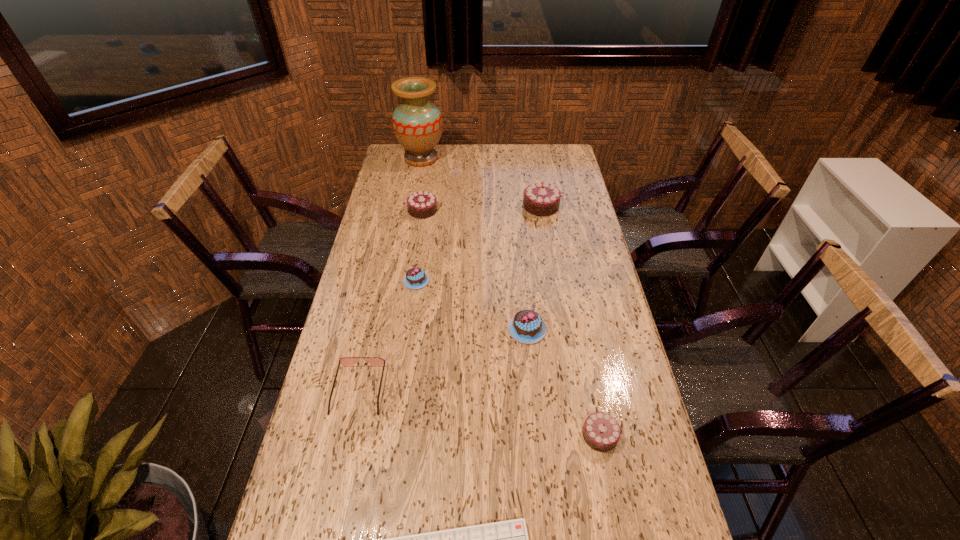
At what (x,y) coordinates should I click in order to perform the action: click on the tallest object. Please return your answer as a coordinate pair (x, y). The height and width of the screenshot is (540, 960). Looking at the image, I should click on (417, 123).

You are a GUI agent. You are given a task and a screenshot of the screen. Output one action in this format:
    pyautogui.click(x=<x>, y=<y>)
    Task: Click on the farthest object
    
    Given the screenshot: What is the action you would take?
    pyautogui.click(x=417, y=123)

Where is `the biggest chocolate chocolate cake`? the biggest chocolate chocolate cake is located at coordinates (541, 199).

Identify the location of the tallest chocolate cake. This screenshot has height=540, width=960. (541, 199).

Locate an element on the screen. Image resolution: width=960 pixels, height=540 pixels. the leftmost chocolate chocolate cake is located at coordinates (422, 204).

You are a GUI agent. You are given a task and a screenshot of the screen. Output one action in this format:
    pyautogui.click(x=<x>, y=<y>)
    Task: Click on the nearer pink chocolate cake
    The height and width of the screenshot is (540, 960).
    Given the screenshot: What is the action you would take?
    pyautogui.click(x=527, y=326)

The height and width of the screenshot is (540, 960). I want to click on the fourth farthest chocolate cake, so click(527, 326).

Locate an element on the screen. the second nearest object is located at coordinates (601, 431).

Locate an element on the screen. This screenshot has height=540, width=960. the smallest chocolate chocolate cake is located at coordinates (601, 431).

Where is `the smaller pink chocolate cake`? the smaller pink chocolate cake is located at coordinates (415, 278).